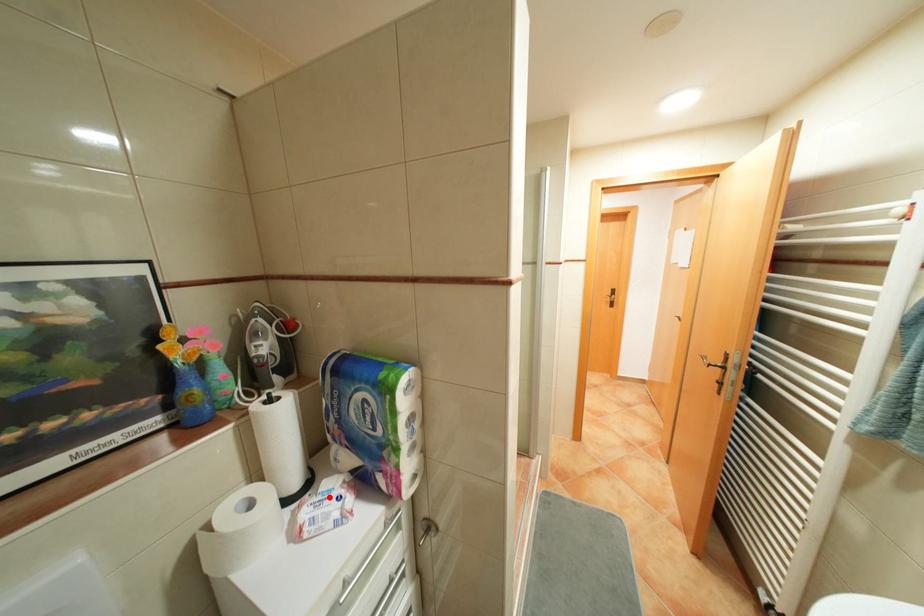
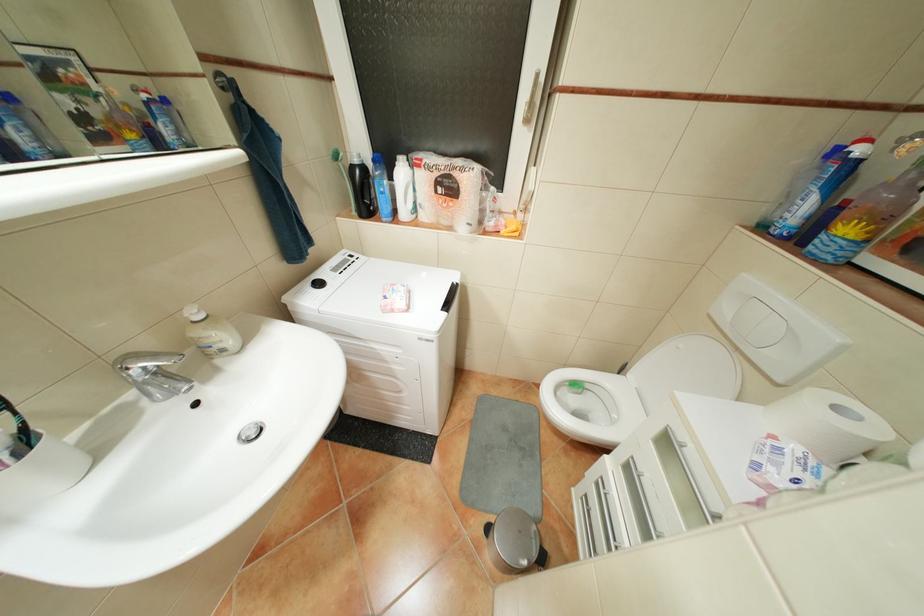
Question: I am providing you with two images of the same scene from different viewpoints. In image1, a red point is highlighted. Considering the same 3D point in image2, which of the following is correct?

Choices:
 (A) It is closer
 (B) It is farther

Answer: (B)